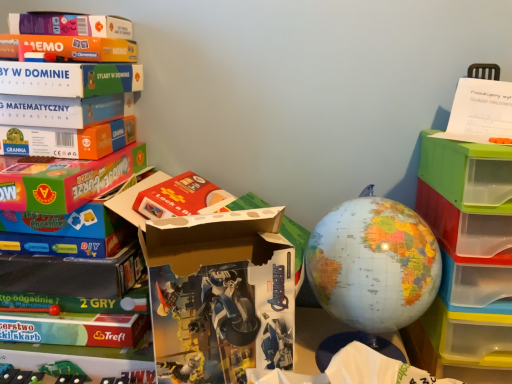
You are a GUI agent. You are given a task and a screenshot of the screen. Output one action in this format:
    pyautogui.click(x=<x>, y=<y>)
    Task: Click on the matte plastic globe at center
    This screenshot has width=512, height=384.
    Given the screenshot: What is the action you would take?
    pyautogui.click(x=374, y=264)

The width and height of the screenshot is (512, 384). What do you see at coordinates (220, 295) in the screenshot? I see `white cardboard box at center` at bounding box center [220, 295].

The width and height of the screenshot is (512, 384). What are the coordinates of `translucent plastic drawers at right` in the screenshot? It's located at (467, 261).

Is matte plastic globe at center positioned with its back to white paper at upper right?

matte plastic globe at center does not have its back to white paper at upper right.

Find the location of a particular element. The image size is (512, 384). paperback book that is on the right side of matte plastic globe at center is located at coordinates 480,112.

Would you say matte plastic globe at center contains white paper at upper right?

No.

Is matte plastic globe at center far away from white paper at upper right?

No.

Who is smaller, white paper at upper right or white cardboard box at center?

Smaller between the two is white paper at upper right.

From the image's perspective, is white paper at upper right on top of white cardboard box at center?

Yes, from the image's perspective, white paper at upper right is on top of white cardboard box at center.

Considering the sizes of objects white paper at upper right and white cardboard box at center in the image provided, who is thinner, white paper at upper right or white cardboard box at center?

white cardboard box at center.

Is white paper at upper right at the right side of white cardboard box at center?

Yes.

You are a GUI agent. You are given a task and a screenshot of the screen. Output one action in this format:
    pyautogui.click(x=<x>, y=<y>)
    Task: Click on the earth behind the white cardboard box at center
    The height and width of the screenshot is (384, 512).
    Given the screenshot: What is the action you would take?
    pyautogui.click(x=374, y=264)

Does white cardboard box at center appear on the right side of matte plastic globe at center?

No.

Is white cardboard box at center directly adjacent to matte plastic globe at center?

No, white cardboard box at center is not making contact with matte plastic globe at center.

Would you consider translucent plastic drawers at right to be distant from white paper at upper right?

translucent plastic drawers at right is actually quite close to white paper at upper right.

Is the depth of translucent plastic drawers at right less than that of white paper at upper right?

Yes, translucent plastic drawers at right is closer to the camera.

Looking at this image, how many degrees apart are the facing directions of translucent plastic drawers at right and white paper at upper right?

The angular difference between translucent plastic drawers at right and white paper at upper right is 16.4 degrees.

Based on the photo, is translucent plastic drawers at right taller than white paper at upper right?

Correct, translucent plastic drawers at right is much taller as white paper at upper right.

Can you confirm if matte plastic globe at center is bigger than translucent plastic drawers at right?

No, matte plastic globe at center is not bigger than translucent plastic drawers at right.

Is matte plastic globe at center behind translucent plastic drawers at right?

Yes, the depth of matte plastic globe at center is greater than that of translucent plastic drawers at right.

Are matte plastic globe at center and translucent plastic drawers at right making contact?

No, matte plastic globe at center is not beside translucent plastic drawers at right.

Would you say matte plastic globe at center is a long distance from white cardboard box at center?

No, there isn't a large distance between matte plastic globe at center and white cardboard box at center.

Would you say matte plastic globe at center is outside white cardboard box at center?

Yes, matte plastic globe at center is outside of white cardboard box at center.

Measure the distance between matte plastic globe at center and white cardboard box at center.

matte plastic globe at center and white cardboard box at center are 6.37 inches apart.

Is point (316, 238) more distant than point (227, 230)?

Yes.

Is white cardboard box at center next to white paper at upper right?

white cardboard box at center and white paper at upper right are clearly separated.

From a real-world perspective, is white cardboard box at center physically located above or below white paper at upper right?

white cardboard box at center is situated lower than white paper at upper right in the real world.

Is the depth of white cardboard box at center less than that of white paper at upper right?

Yes, it is in front of white paper at upper right.

Can you tell me how much white cardboard box at center and white paper at upper right differ in facing direction?

43.8 degrees separate the facing orientations of white cardboard box at center and white paper at upper right.

Image resolution: width=512 pixels, height=384 pixels. I want to click on paperback book above the matte plastic globe at center (from the image's perspective), so click(x=480, y=112).

Locate an element on the screen. paperback book positioned vertically above the white cardboard box at center (from a real-world perspective) is located at coordinates (480, 112).

Looking at the image, which one is located further to white cardboard box at center, matte plastic globe at center or translucent plastic drawers at right?

Among the two, translucent plastic drawers at right is located further to white cardboard box at center.

Which object lies nearer to the anchor point translucent plastic drawers at right, matte plastic globe at center or white cardboard box at center?

The object closer to translucent plastic drawers at right is matte plastic globe at center.

Considering their positions, is white cardboard box at center positioned further to white paper at upper right than matte plastic globe at center?

Based on the image, white cardboard box at center appears to be further to white paper at upper right.

Looking at the image, which one is located closer to white paper at upper right, translucent plastic drawers at right or matte plastic globe at center?

translucent plastic drawers at right lies closer to white paper at upper right than the other object.

Estimate the real-world distances between objects in this image. Which object is further from matte plastic globe at center, translucent plastic drawers at right or white cardboard box at center?

white cardboard box at center is further to matte plastic globe at center.

When comparing their distances from translucent plastic drawers at right, does white paper at upper right or white cardboard box at center seem further?

white cardboard box at center is further to translucent plastic drawers at right.

From the image, which object appears to be nearer to translucent plastic drawers at right, white cardboard box at center or matte plastic globe at center?

matte plastic globe at center lies closer to translucent plastic drawers at right than the other object.

When comparing their distances from matte plastic globe at center, does white cardboard box at center or white paper at upper right seem further?

The object further to matte plastic globe at center is white paper at upper right.

In order to click on earth between white cardboard box at center and white paper at upper right from left to right in this screenshot , I will do `click(374, 264)`.

This screenshot has width=512, height=384. Find the location of `earth that lies between white paper at upper right and translucent plastic drawers at right from top to bottom`. earth that lies between white paper at upper right and translucent plastic drawers at right from top to bottom is located at coordinates (374, 264).

In order to click on shelf situated between white cardboard box at center and white paper at upper right from left to right in this screenshot , I will do coord(467,261).

Find the location of `earth between white cardboard box at center and translucent plastic drawers at right from left to right`. earth between white cardboard box at center and translucent plastic drawers at right from left to right is located at coordinates (374, 264).